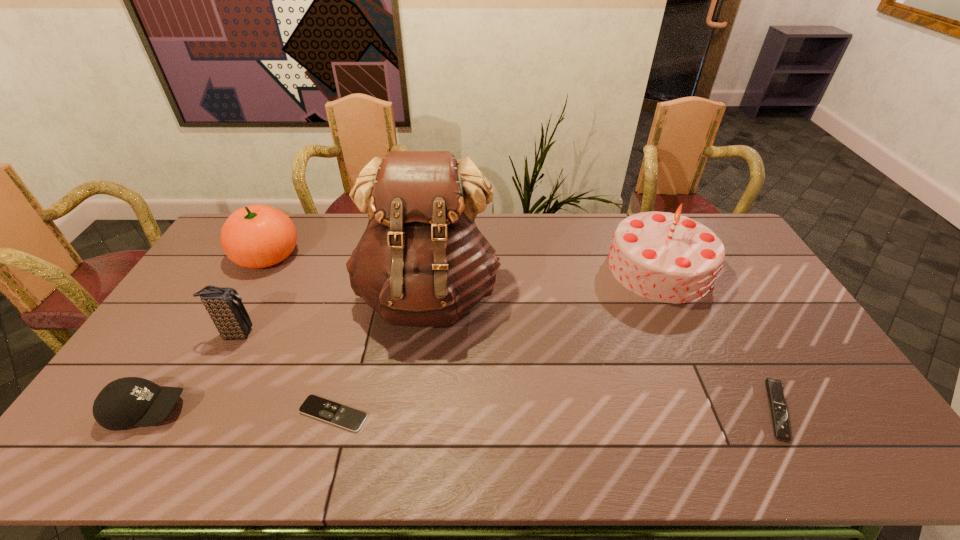
I want to click on vacant space situated on the front of the sixth shortest object, so click(x=695, y=345).

The width and height of the screenshot is (960, 540). I want to click on vacant area situated 0.090m on the back of the pumpkin, so click(x=286, y=221).

The height and width of the screenshot is (540, 960). Find the location of `vacant space located with the zip open on the clutch bag`. vacant space located with the zip open on the clutch bag is located at coordinates (296, 334).

Identify the location of free space located on the front-facing side of the baseball cap. This screenshot has height=540, width=960. (266, 410).

Locate an element on the screen. vacant position located 0.170m on the back of the right remote control is located at coordinates (733, 333).

At what (x,y) coordinates should I click in order to perform the action: click on free spot located 0.090m on the right of the shorter remote control. Please return your answer as a coordinate pair (x, y). The image size is (960, 540). Looking at the image, I should click on (403, 414).

You are a GUI agent. You are given a task and a screenshot of the screen. Output one action in this format:
    pyautogui.click(x=<x>, y=<y>)
    Task: Click on the birthday cake that is at the far edge
    The image size is (960, 540).
    Given the screenshot: What is the action you would take?
    pyautogui.click(x=666, y=257)

Image resolution: width=960 pixels, height=540 pixels. What are the coordinates of `pumpkin at the far edge` in the screenshot? It's located at (256, 236).

At what (x,y) coordinates should I click in order to perform the action: click on baseball cap located in the near edge section of the desktop. Please return your answer as a coordinate pair (x, y). The height and width of the screenshot is (540, 960). Looking at the image, I should click on (131, 401).

Where is `pumpkin that is at the left edge`? Image resolution: width=960 pixels, height=540 pixels. pumpkin that is at the left edge is located at coordinates (256, 236).